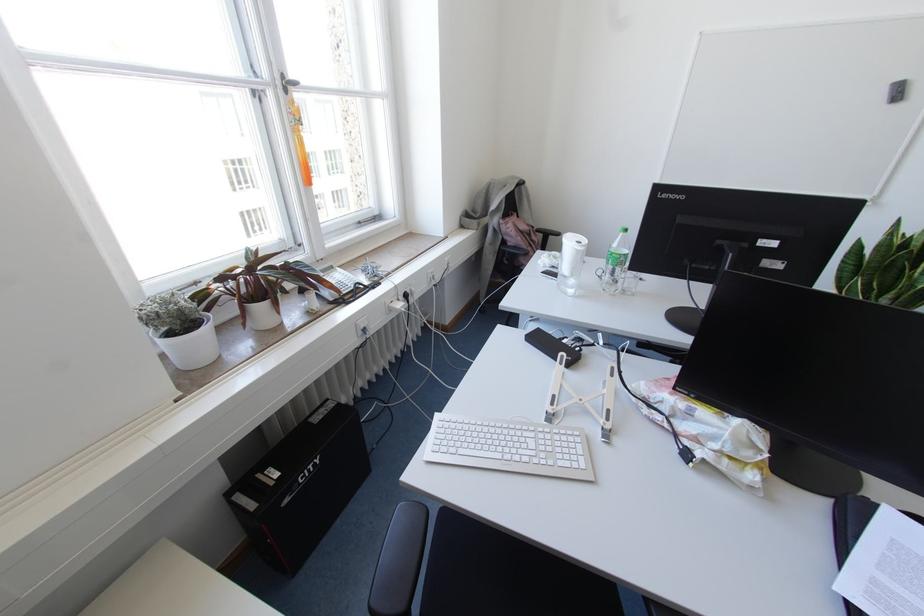
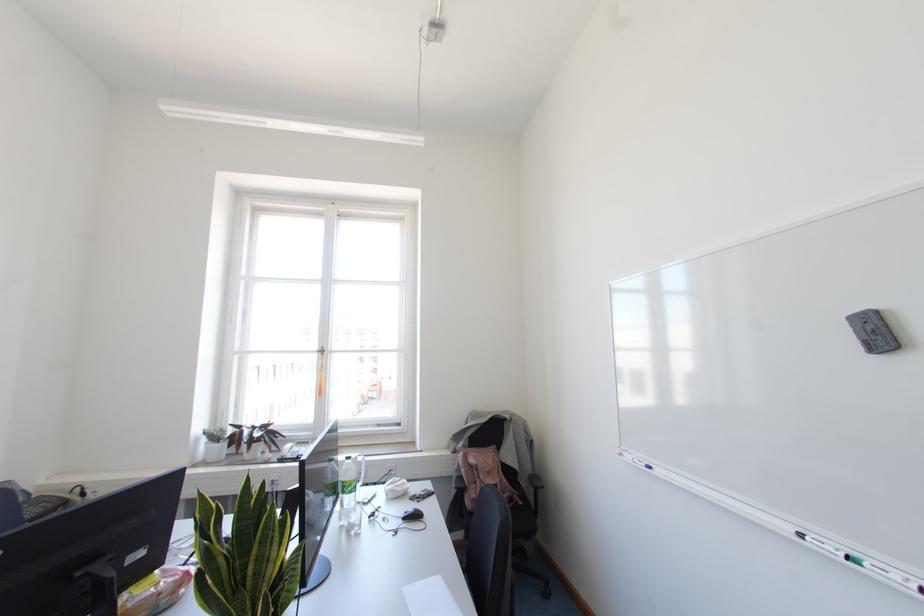
Find the pixel in the second image that matches point (186, 298) in the first image.

(223, 431)